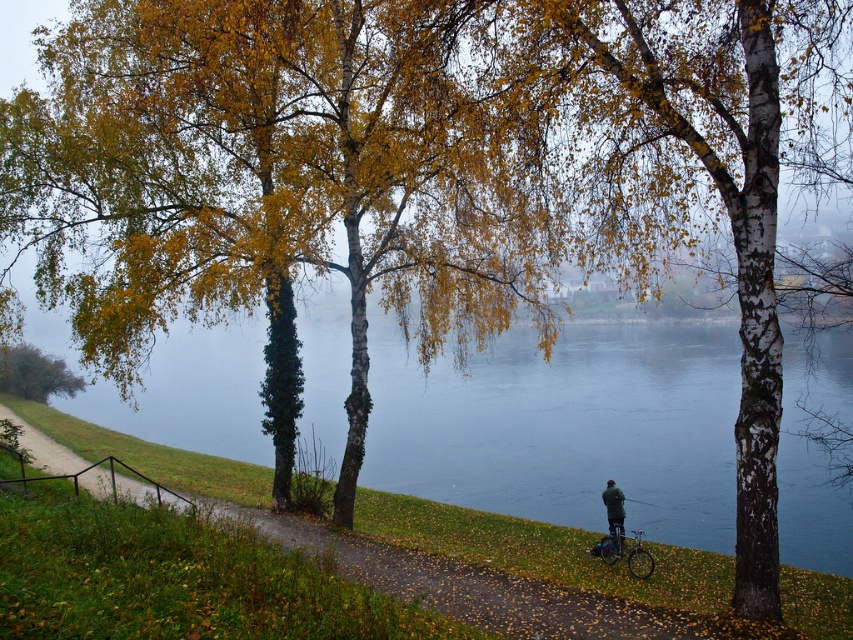
In the scene shown: You are a hiker standing on the riverside path and want to reach the dark green jacket at lower right. Which direction should you walk to get closer to it without passing the green matte tree at lower left?

You should walk away from the green matte tree at lower left because it is closer to you than the dark green jacket at lower right, so moving away from the tree will bring you closer to the jacket.

You are a hiker who has just arrived at the riverside and wants to check if your jacket is placed correctly. According to the scene, is the dark green fabric jacket at lower right positioned above the silver metallic bicycle at lower right?

Yes, the dark green fabric jacket at lower right is positioned above the silver metallic bicycle at lower right as described in the scene.

You are standing at the starting point of the path along the riverside. You see two points marked on the ground ahead of you. The first point is at coordinates point (786, 333) and the second is at point (618, 500). Which point will you reach first as you walk forward along the path?

Point (786, 333) is in front of point (618, 500), so you will reach point (786, 333) first as you walk forward along the path.